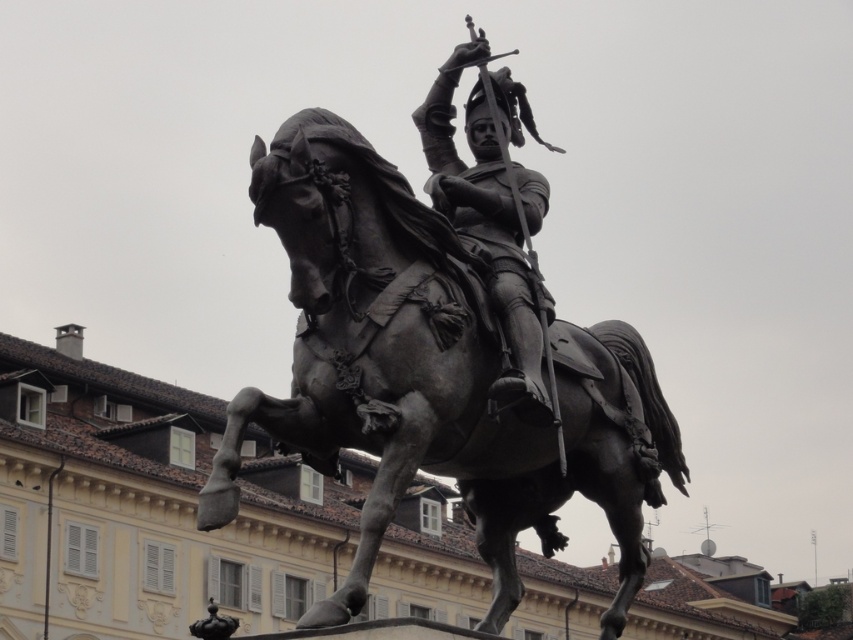
Based on the photo, is bronze horse at center to the left of polished bronze knight at center from the viewer's perspective?

Correct, you'll find bronze horse at center to the left of polished bronze knight at center.

Does bronze horse at center have a lesser width compared to polished bronze knight at center?

No.

Where is `bronze horse at center`? The width and height of the screenshot is (853, 640). bronze horse at center is located at coordinates (433, 376).

Identify the location of bronze horse at center. Image resolution: width=853 pixels, height=640 pixels. (433, 376).